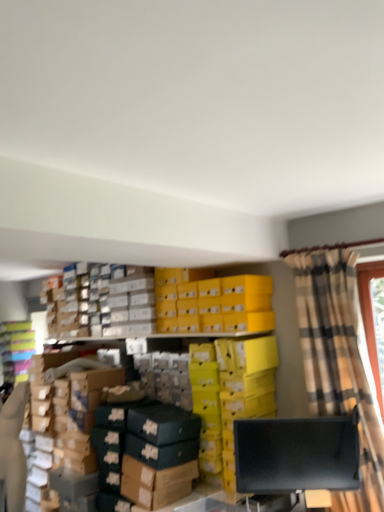
Question: Can you confirm if black matte monitor at lower right is taller than matte plastic shoebox at left?

Choices:
 (A) yes
 (B) no

Answer: (B)

Question: Is matte plastic shoebox at left completely or partially inside black matte monitor at lower right?

Choices:
 (A) no
 (B) yes

Answer: (A)

Question: From a real-world perspective, does black matte monitor at lower right sit lower than matte plastic shoebox at left?

Choices:
 (A) yes
 (B) no

Answer: (A)

Question: From a real-world perspective, is black matte monitor at lower right positioned over matte plastic shoebox at left based on gravity?

Choices:
 (A) no
 (B) yes

Answer: (A)

Question: Considering the relative sizes of black matte monitor at lower right and matte plastic shoebox at left in the image provided, is black matte monitor at lower right wider than matte plastic shoebox at left?

Choices:
 (A) no
 (B) yes

Answer: (A)

Question: Relative to matte plastic shoebox at left, is plaid fabric curtain at right in front or behind?

Choices:
 (A) behind
 (B) front

Answer: (B)

Question: Looking at their shapes, would you say plaid fabric curtain at right is wider or thinner than matte plastic shoebox at left?

Choices:
 (A) wide
 (B) thin

Answer: (B)

Question: Is plaid fabric curtain at right taller or shorter than matte plastic shoebox at left?

Choices:
 (A) short
 (B) tall

Answer: (B)

Question: Looking at the image, does plaid fabric curtain at right seem bigger or smaller compared to matte plastic shoebox at left?

Choices:
 (A) big
 (B) small

Answer: (A)

Question: In terms of size, does black matte monitor at lower right appear bigger or smaller than plaid fabric curtain at right?

Choices:
 (A) small
 (B) big

Answer: (A)

Question: Is black matte monitor at lower right to the left or to the right of plaid fabric curtain at right in the image?

Choices:
 (A) right
 (B) left

Answer: (B)

Question: Is black matte monitor at lower right wider or thinner than plaid fabric curtain at right?

Choices:
 (A) wide
 (B) thin

Answer: (B)

Question: Is black matte monitor at lower right in front of or behind plaid fabric curtain at right in the image?

Choices:
 (A) front
 (B) behind

Answer: (B)

Question: Does point (246, 470) appear closer or farther from the camera than point (16, 361)?

Choices:
 (A) farther
 (B) closer

Answer: (B)

Question: From a real-world perspective, is black matte monitor at lower right above or below matte plastic shoebox at left?

Choices:
 (A) below
 (B) above

Answer: (A)